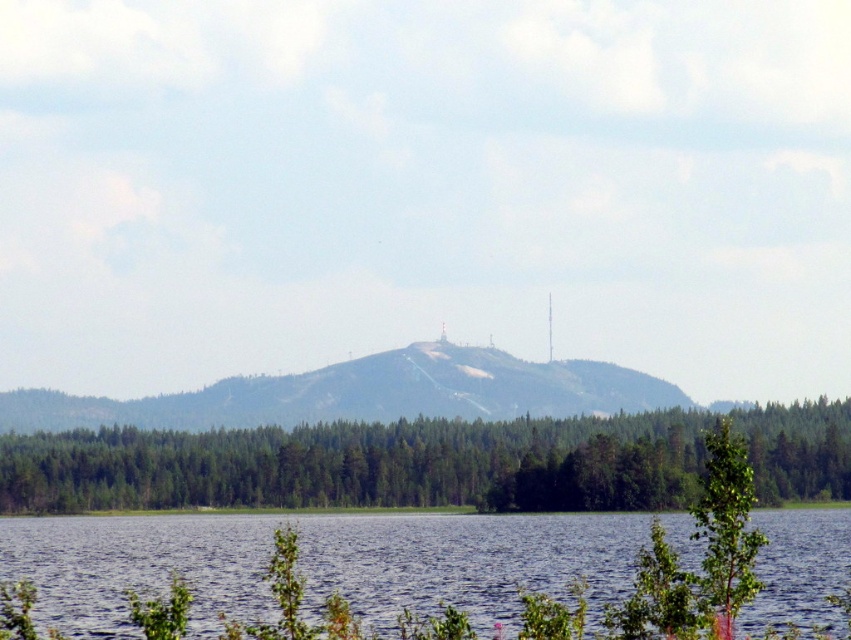
You are a hiker planning to take a photo of the green forested mountain at center from the blue water at lower center. Will the mountain be visible in your photo if you stand at the water?

The blue water at lower center is positioned under green forested mountain at center, so yes, the mountain will be visible in your photo when standing at the water.

You are standing at the center of the image and want to locate the blue water at lower center. According to the coordinates provided, in which direction should you look to find it?

The blue water at lower center is located at coordinates point [317,564]. Since the y coordinate is 0.374, which is lower than 0.5, you should look downward from the center to find it.